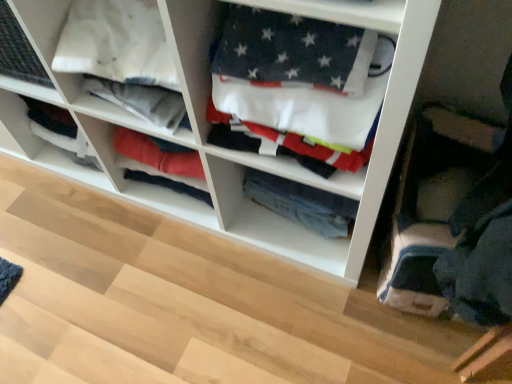
This screenshot has height=384, width=512. I want to click on free space in front of white fabric at center, so click(x=162, y=292).